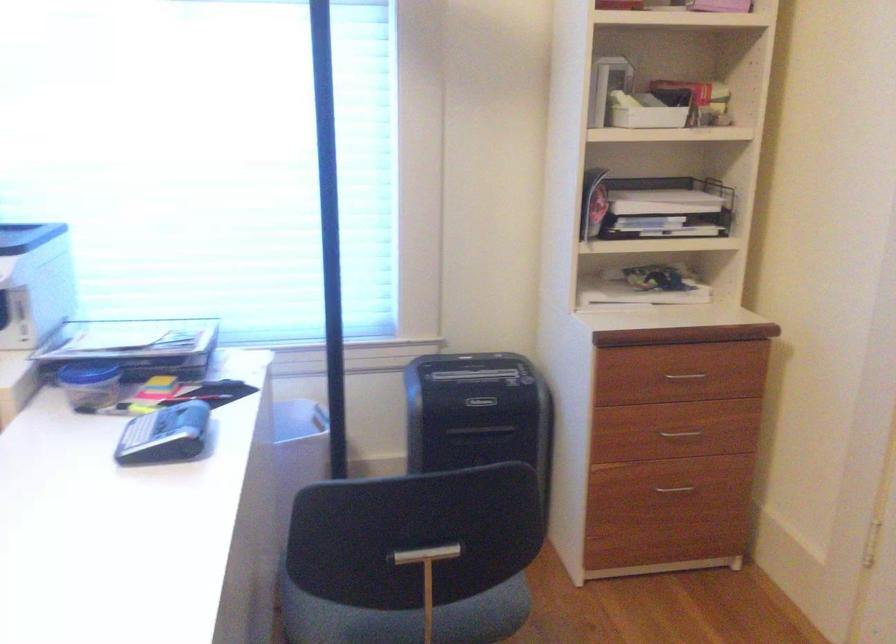
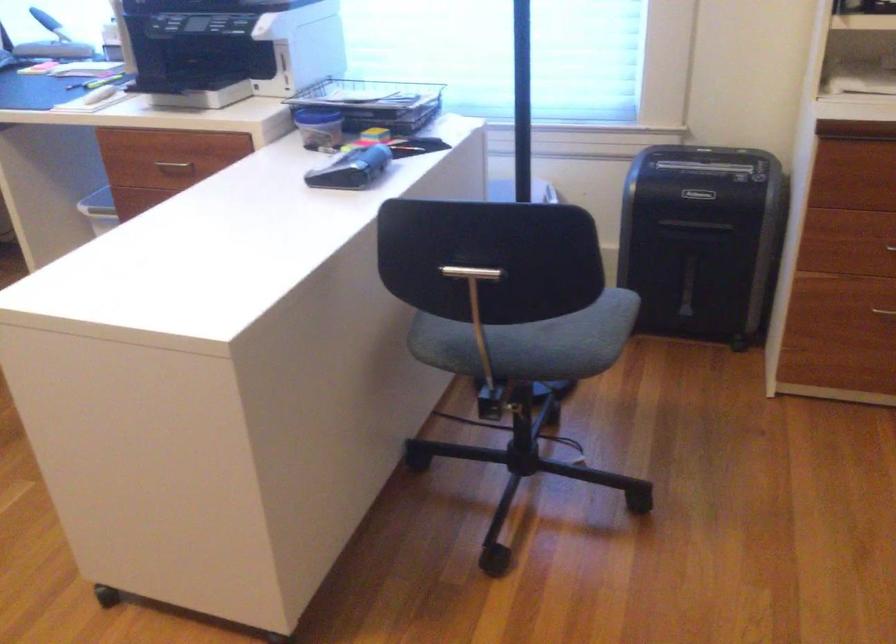
Find the pixel in the second image that matches [479,431] in the first image.

(693, 225)